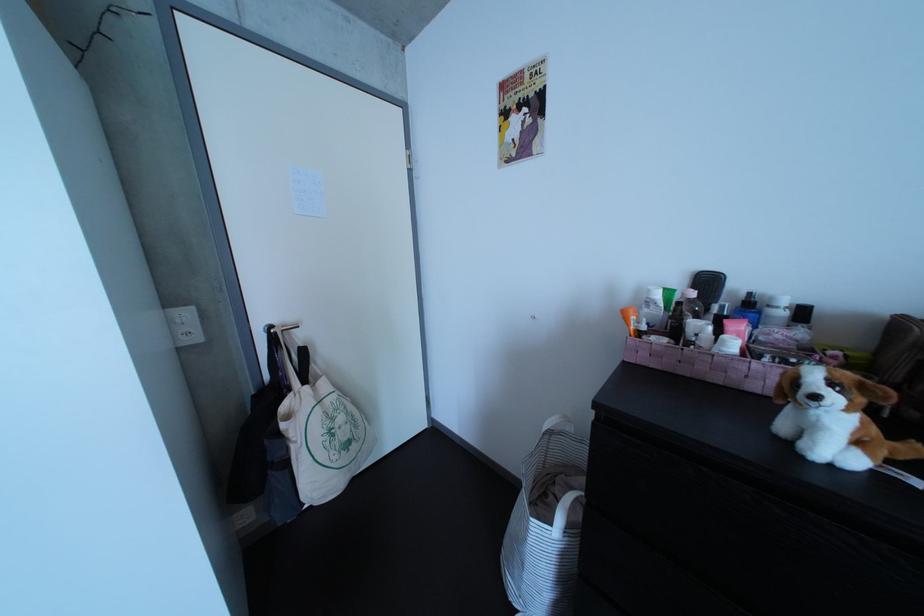
The height and width of the screenshot is (616, 924). What do you see at coordinates (835, 418) in the screenshot? I see `a blue spray nozzle` at bounding box center [835, 418].